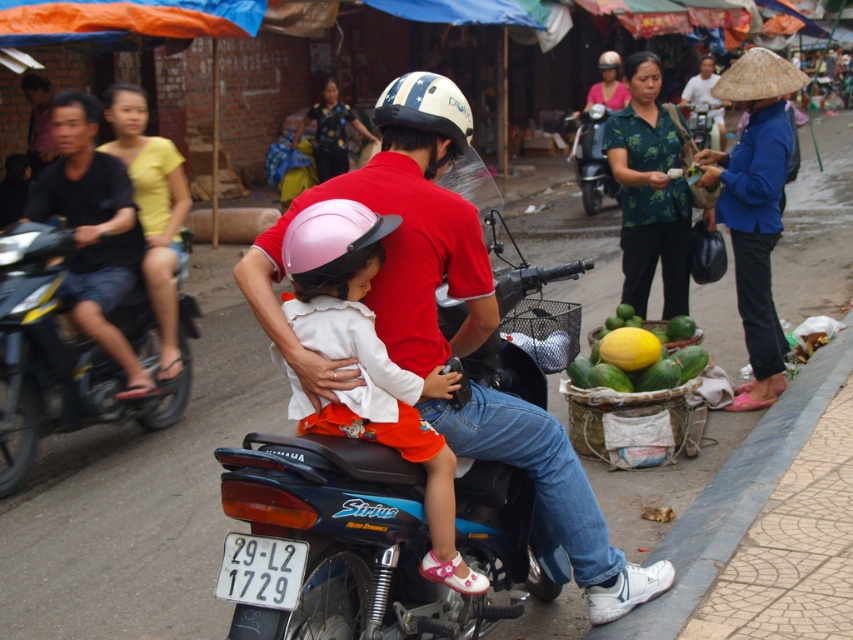
Can you confirm if dark blue jeans at left is shorter than blue fabric hat at upper right?

No, dark blue jeans at left is not shorter than blue fabric hat at upper right.

Who is more distant from viewer, (80, 307) or (701, 76)?

Point (701, 76)

Where is `dark blue jeans at left`? Image resolution: width=853 pixels, height=640 pixels. dark blue jeans at left is located at coordinates (93, 230).

How much distance is there between blue fabric hat at right and white plastic license plate at lower center?

blue fabric hat at right and white plastic license plate at lower center are 13.93 feet apart from each other.

Is blue fabric hat at right to the right of white plastic license plate at lower center from the viewer's perspective?

Correct, you'll find blue fabric hat at right to the right of white plastic license plate at lower center.

Which is in front, point (780, 189) or point (225, 545)?

Point (225, 545) is in front.

Where is `blue fabric hat at right`? blue fabric hat at right is located at coordinates (755, 208).

Which is more to the left, yellow matte papaya at right or pink matte helmet at center?

Positioned to the left is pink matte helmet at center.

Can you confirm if yellow matte papaya at right is positioned below pink matte helmet at center?

Indeed, yellow matte papaya at right is positioned under pink matte helmet at center.

Is point (625, 364) farther from viewer compared to point (376, 230)?

Yes.

Locate an element on the screen. The image size is (853, 640). yellow matte papaya at right is located at coordinates (x=637, y=356).